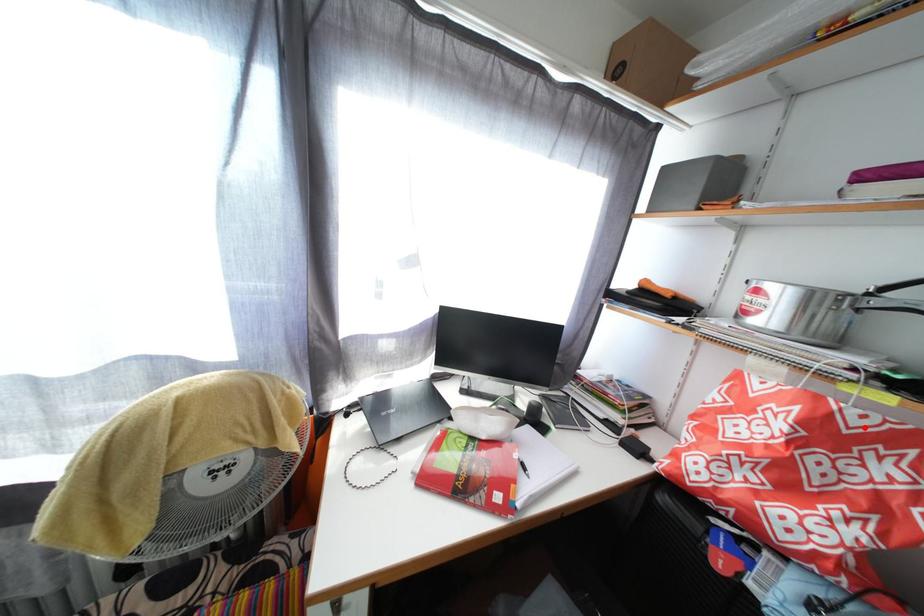
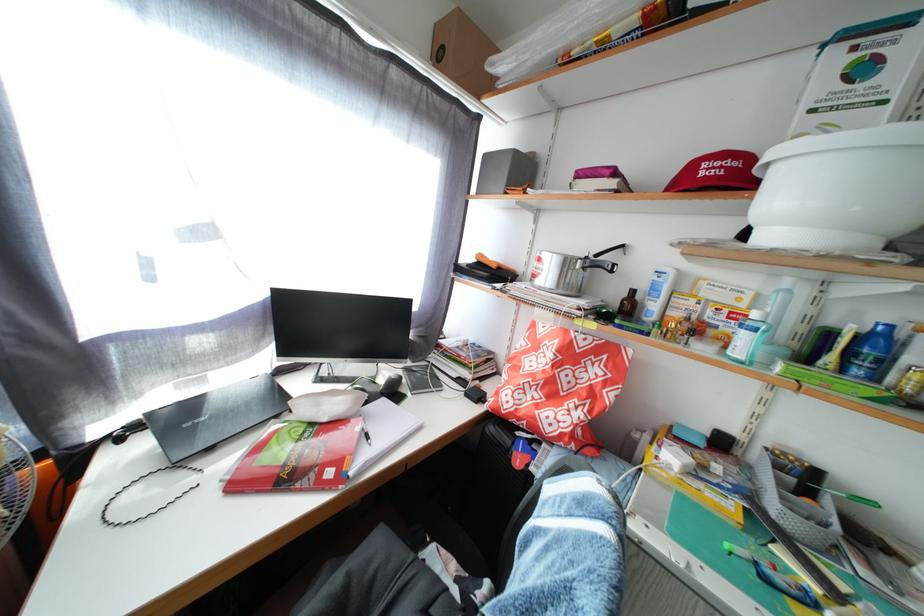
In the second image, find the point that corresponds to the highlighted location in the first image.

(590, 350)